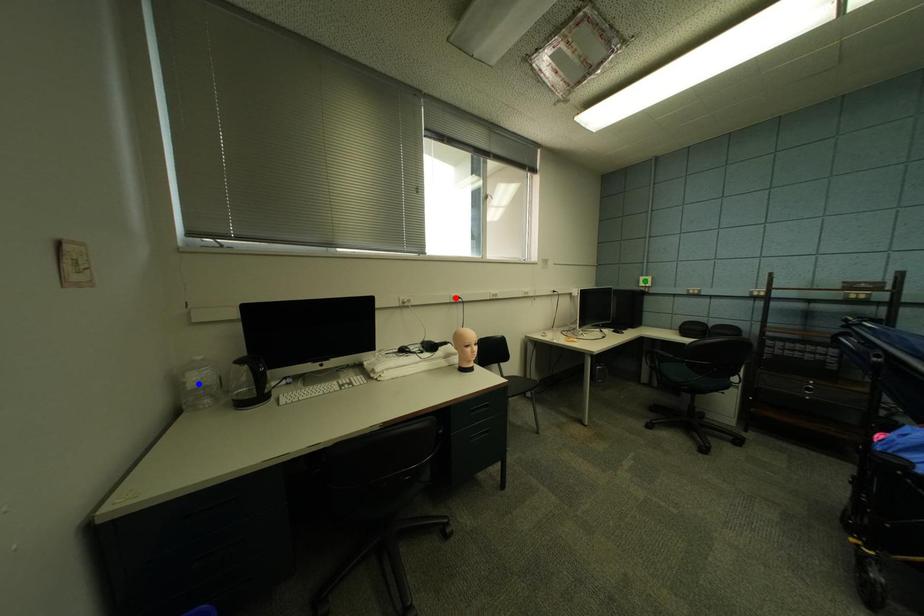
Order these from nearest to farthest:
green point, red point, blue point

blue point → red point → green point